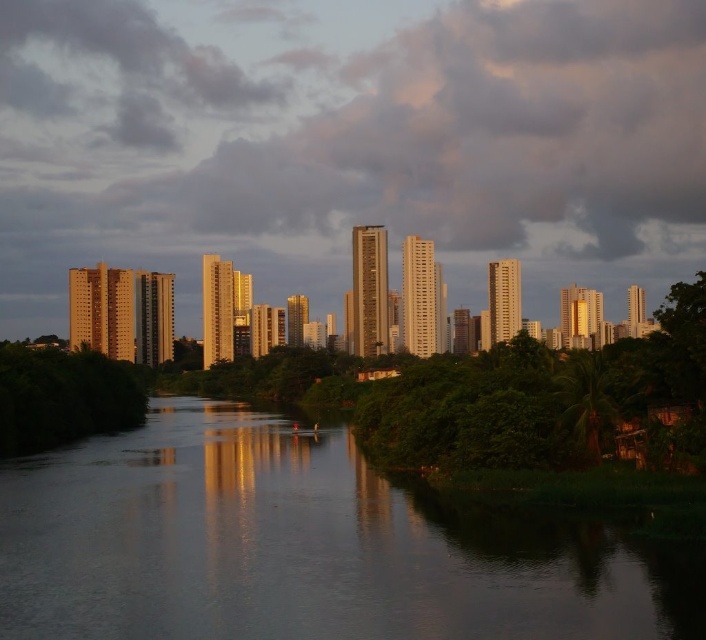
Question: Is the position of gray cloudy sky at upper center more distant than that of smooth reflective water at center?

Choices:
 (A) yes
 (B) no

Answer: (A)

Question: Does gray cloudy sky at upper center come in front of green leafy tree at lower left?

Choices:
 (A) no
 (B) yes

Answer: (A)

Question: Which point is farther to the camera?

Choices:
 (A) click(537, 140)
 (B) click(209, 522)
 (C) click(23, 433)

Answer: (A)

Question: Among these objects, which one is nearest to the camera?

Choices:
 (A) gray cloudy sky at upper center
 (B) smooth reflective water at center
 (C) green leafy tree at lower left

Answer: (B)

Question: Among these points, which one is farthest from the camera?

Choices:
 (A) tap(37, 424)
 (B) tap(197, 33)
 (C) tap(287, 566)

Answer: (B)

Question: Can you confirm if gray cloudy sky at upper center is positioned to the right of green leafy tree at lower left?

Choices:
 (A) no
 (B) yes

Answer: (B)